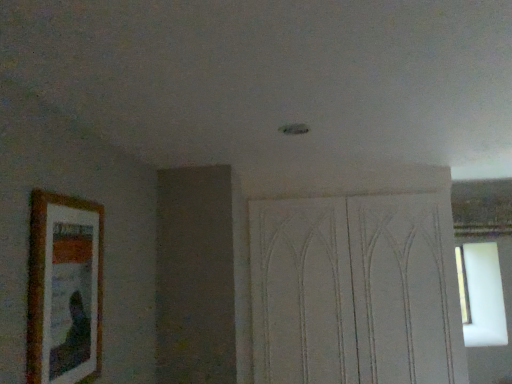
Question: From a real-world perspective, is white textured screen door at center physically located above or below wooden picture frame at left?

Choices:
 (A) below
 (B) above

Answer: (A)

Question: Does point (359, 226) appear closer or farther from the camera than point (92, 339)?

Choices:
 (A) closer
 (B) farther

Answer: (B)

Question: Is white textured screen door at center situated inside wooden picture frame at left or outside?

Choices:
 (A) inside
 (B) outside

Answer: (B)

Question: Looking at the image, does wooden picture frame at left seem bigger or smaller compared to white textured screen door at center?

Choices:
 (A) small
 (B) big

Answer: (A)

Question: Considering the positions of wooden picture frame at left and white textured screen door at center in the image, is wooden picture frame at left taller or shorter than white textured screen door at center?

Choices:
 (A) tall
 (B) short

Answer: (B)

Question: Is point (70, 288) closer or farther from the camera than point (434, 289)?

Choices:
 (A) farther
 (B) closer

Answer: (B)

Question: Looking at their shapes, would you say wooden picture frame at left is wider or thinner than white textured screen door at center?

Choices:
 (A) wide
 (B) thin

Answer: (B)